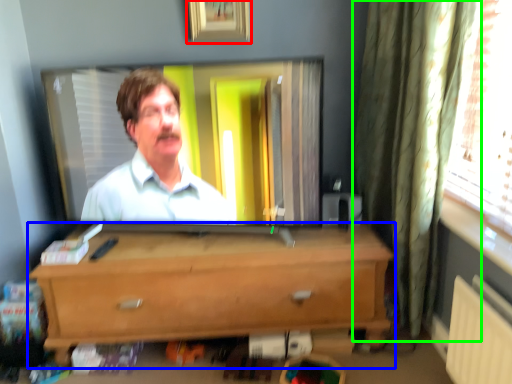
Question: Which object is the farthest from picture frame (highlighted by a red box)? Choose among these: chest of drawers (highlighted by a blue box) or curtain (highlighted by a green box).

Choices:
 (A) chest of drawers
 (B) curtain

Answer: (A)